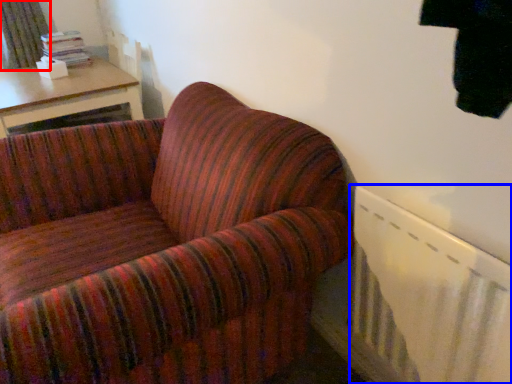
Question: Which object is closer to the camera taking this photo, curtain (highlighted by a red box) or radiator (highlighted by a blue box)?

Choices:
 (A) curtain
 (B) radiator

Answer: (B)